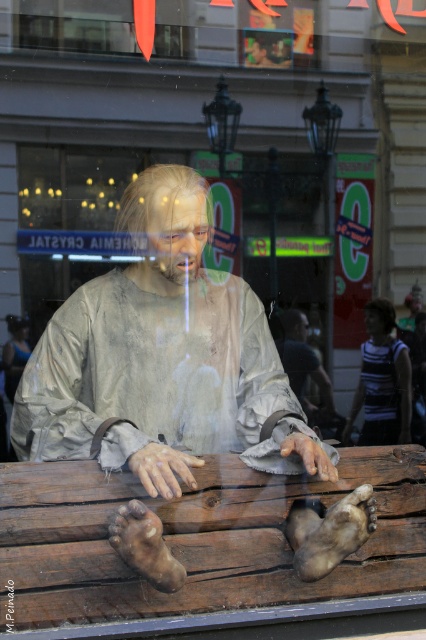
Question: Is matte gray mannequin at center thinner than brown wooden bench at lower center?

Choices:
 (A) yes
 (B) no

Answer: (A)

Question: Can you confirm if brown wooden bench at lower center is positioned to the right of striped fabric shirt at center?

Choices:
 (A) yes
 (B) no

Answer: (B)

Question: Estimate the real-world distances between objects in this image. Which object is closer to the brown wooden bench at lower center?

Choices:
 (A) striped fabric shirt at center
 (B) matte gray mannequin at center

Answer: (B)

Question: Which point is farther from the camera taking this photo?

Choices:
 (A) (377, 305)
 (B) (74, 426)
 (C) (69, 515)

Answer: (A)

Question: Which object appears farthest from the camera in this image?

Choices:
 (A) striped fabric shirt at center
 (B) brown wooden bench at lower center

Answer: (A)

Question: Does matte gray mannequin at center appear under striped fabric shirt at center?

Choices:
 (A) no
 (B) yes

Answer: (A)